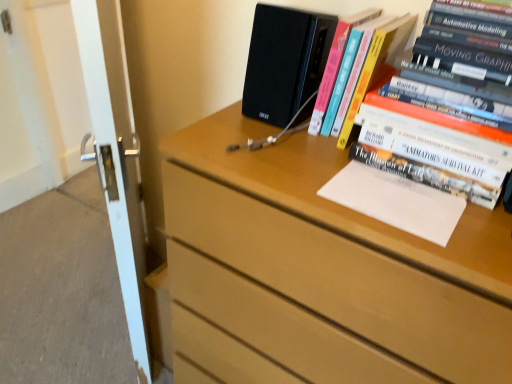
Question: Does wooden chest of drawers at upper right appear on the left side of white paper at upper right?

Choices:
 (A) no
 (B) yes

Answer: (B)

Question: Is white paper at upper right inside wooden chest of drawers at upper right?

Choices:
 (A) no
 (B) yes

Answer: (A)

Question: From the image's perspective, is wooden chest of drawers at upper right located beneath white paper at upper right?

Choices:
 (A) yes
 (B) no

Answer: (A)

Question: Is wooden chest of drawers at upper right further to camera compared to white paper at upper right?

Choices:
 (A) no
 (B) yes

Answer: (A)

Question: Does wooden chest of drawers at upper right appear on the right side of white paper at upper right?

Choices:
 (A) no
 (B) yes

Answer: (A)

Question: In terms of size, does white paper at upper right appear bigger or smaller than white glossy screen door at left?

Choices:
 (A) small
 (B) big

Answer: (A)

Question: From their relative heights in the image, would you say white paper at upper right is taller or shorter than white glossy screen door at left?

Choices:
 (A) short
 (B) tall

Answer: (A)

Question: In the image, is white paper at upper right positioned in front of or behind white glossy screen door at left?

Choices:
 (A) behind
 (B) front

Answer: (B)

Question: Is point (435, 198) closer or farther from the camera than point (104, 21)?

Choices:
 (A) closer
 (B) farther

Answer: (A)

Question: In terms of height, does wooden chest of drawers at upper right look taller or shorter compared to white glossy screen door at left?

Choices:
 (A) short
 (B) tall

Answer: (A)

Question: In terms of size, does wooden chest of drawers at upper right appear bigger or smaller than white glossy screen door at left?

Choices:
 (A) small
 (B) big

Answer: (B)

Question: Is wooden chest of drawers at upper right wider or thinner than white glossy screen door at left?

Choices:
 (A) wide
 (B) thin

Answer: (A)

Question: Relative to white glossy screen door at left, is wooden chest of drawers at upper right in front or behind?

Choices:
 (A) behind
 (B) front

Answer: (B)

Question: Looking at their shapes, would you say hardcover books at upper right, positioned as the 2th book in left-to-right order, is wider or thinner than hardcover book at upper right, which appears as the second book when viewed from the right?

Choices:
 (A) thin
 (B) wide

Answer: (B)

Question: Choose the correct answer: Is hardcover books at upper right, which is the 1th book in right-to-left order, inside hardcover book at upper right, which appears as the second book when viewed from the right, or outside it?

Choices:
 (A) outside
 (B) inside

Answer: (A)